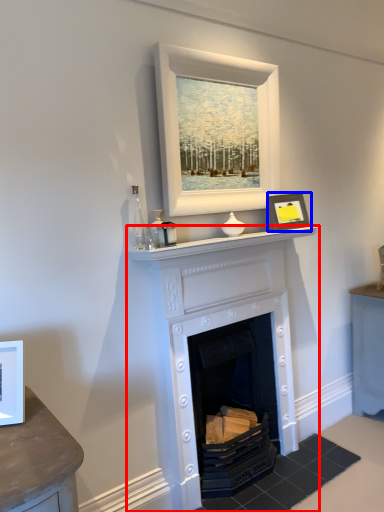
Question: Which object is further to the camera taking this photo, fireplace (highlighted by a red box) or picture frame (highlighted by a blue box)?

Choices:
 (A) fireplace
 (B) picture frame

Answer: (B)